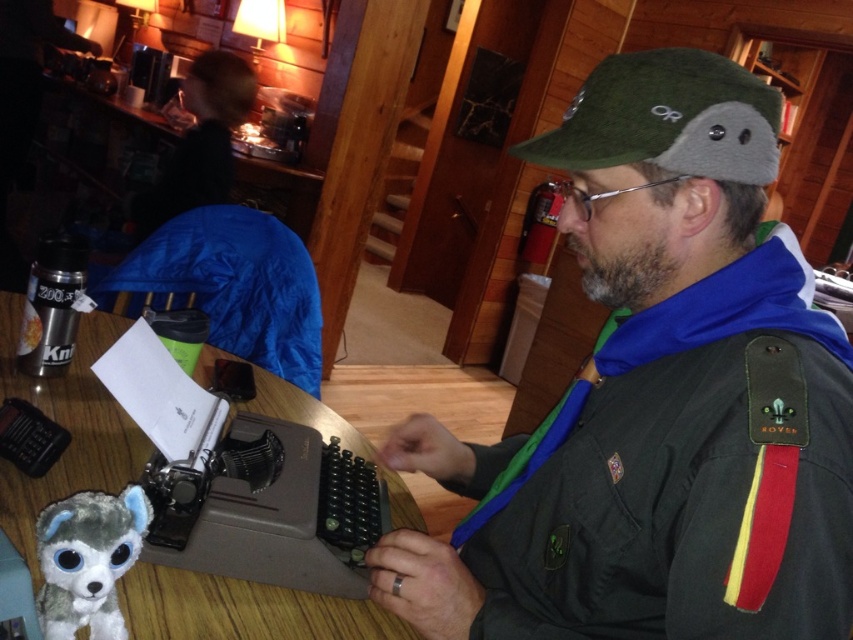
Question: Can you confirm if green fabric cap at upper right is bigger than fuzzy plush toy at lower left?

Choices:
 (A) no
 (B) yes

Answer: (B)

Question: Which object appears closest to the camera in this image?

Choices:
 (A) fuzzy plush toy at lower left
 (B) wooden table at center
 (C) green fabric cap at upper right

Answer: (C)

Question: Which object is farther from the camera taking this photo?

Choices:
 (A) wooden table at center
 (B) green fabric cap at upper right
 (C) fuzzy plush toy at lower left

Answer: (A)

Question: Is wooden table at center smaller than fuzzy plush toy at lower left?

Choices:
 (A) no
 (B) yes

Answer: (A)

Question: Which point appears closest to the camera in this image?

Choices:
 (A) (73, 522)
 (B) (25, 524)

Answer: (A)

Question: Is green fabric cap at upper right behind fuzzy plush toy at lower left?

Choices:
 (A) no
 (B) yes

Answer: (A)